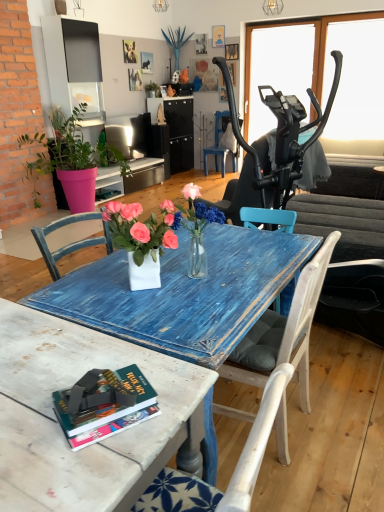
Question: Looking at their shapes, would you say green matte plant at upper center, marked as the 1th houseplant in a back-to-front arrangement, is wider or thinner than white painted wood chair at center, which is counted as the 1th chair, starting from the bottom?

Choices:
 (A) wide
 (B) thin

Answer: (B)

Question: Does point (160, 93) appear closer or farther from the camera than point (302, 384)?

Choices:
 (A) closer
 (B) farther

Answer: (B)

Question: Estimate the real-world distances between objects in this image. Which object is closer to the blue textured vase at upper center?

Choices:
 (A) pink plastic pot at left, which is counted as the 1th houseplant, starting from the bottom
 (B) hardcover book at lower left
 (C) white glossy vase at center
 (D) transparent glass window screen at upper right
 (E) green matte plant at upper center, marked as the 1th houseplant in a back-to-front arrangement

Answer: (E)

Question: Estimate the real-world distances between objects in this image. Which object is closer to the pink plastic pot at left, the 2th houseplant in the top-to-bottom sequence?

Choices:
 (A) blue textured vase at upper center
 (B) green matte plant at upper center, marked as the 1th houseplant in a back-to-front arrangement
 (C) hardcover book at lower left
 (D) white glossy vase at center
 (E) blue painted wood chair at center, acting as the 1th chair starting from the back

Answer: (B)